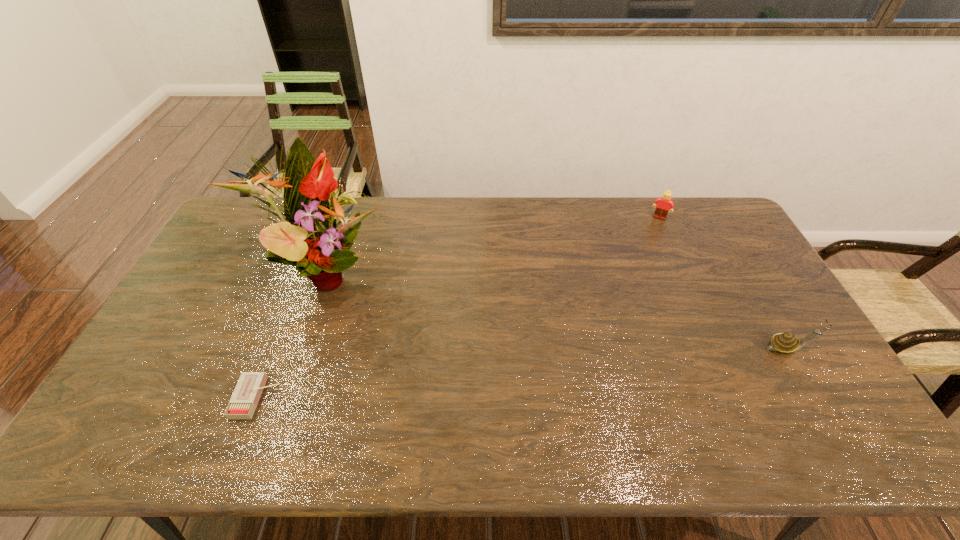
Where is `free space that is in between the farthest object and the nearest object`? This screenshot has width=960, height=540. free space that is in between the farthest object and the nearest object is located at coordinates (458, 308).

At what (x,y) coordinates should I click in order to perform the action: click on free spot between the second object from right to left and the snail. Please return your answer as a coordinate pair (x, y). Looking at the image, I should click on (724, 283).

Image resolution: width=960 pixels, height=540 pixels. Identify the location of free spot between the matchbox and the tallest object. (291, 335).

What are the coordinates of `empty space between the second object from right to left and the shortest object` in the screenshot? It's located at (458, 308).

Point out which object is positioned as the nearest to the farthest object. Please provide its 2D coordinates. Your answer should be formatted as a tuple, i.e. [(x, y)], where the tuple contains the x and y coordinates of a point satisfying the conditions above.

[(786, 343)]

Image resolution: width=960 pixels, height=540 pixels. Identify the location of object that is the second closest to the nearest object. (786, 343).

The height and width of the screenshot is (540, 960). Identify the location of free space that satisfies the following two spatial constraints: 1. on the front side of the snail; 2. on the face of the third nearest object. point(300,348).

Locate an element on the screen. Image resolution: width=960 pixels, height=540 pixels. free space that satisfies the following two spatial constraints: 1. on the front side of the tallest object; 2. on the face of the snail is located at coordinates (300, 348).